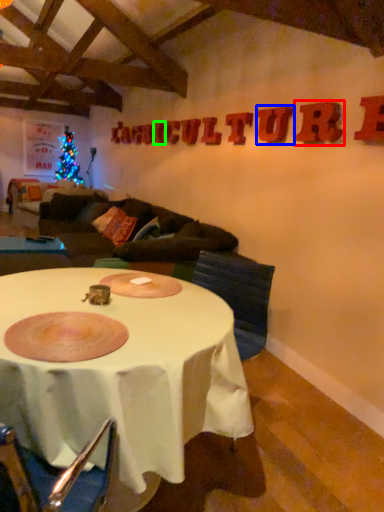
Question: Considering the real-world distances, which object is closest to letter (highlighted by a red box)? letter (highlighted by a blue box) or letter (highlighted by a green box).

Choices:
 (A) letter
 (B) letter

Answer: (A)